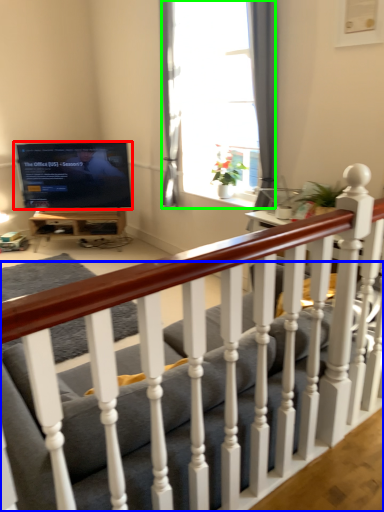
Question: Which is nearer to the television (highlighted by a red box)? studio couch (highlighted by a blue box) or window (highlighted by a green box).

Choices:
 (A) studio couch
 (B) window

Answer: (B)